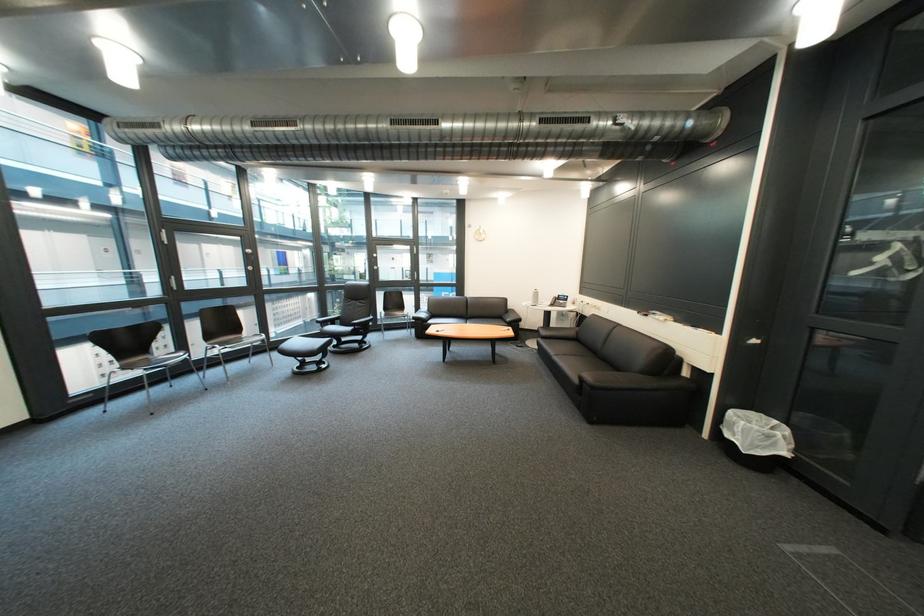
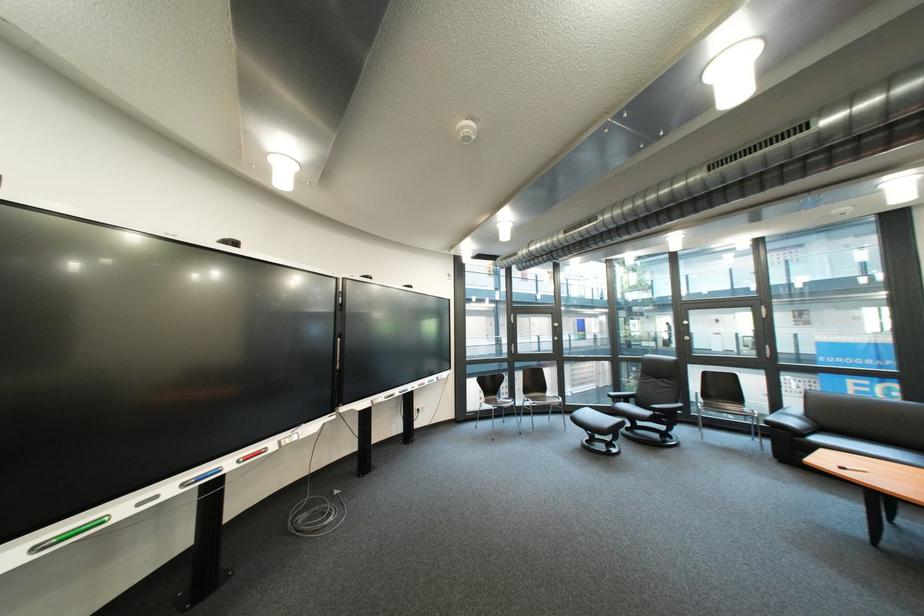
In the second image, find the point that corresponds to (310,370) in the first image.

(601, 443)